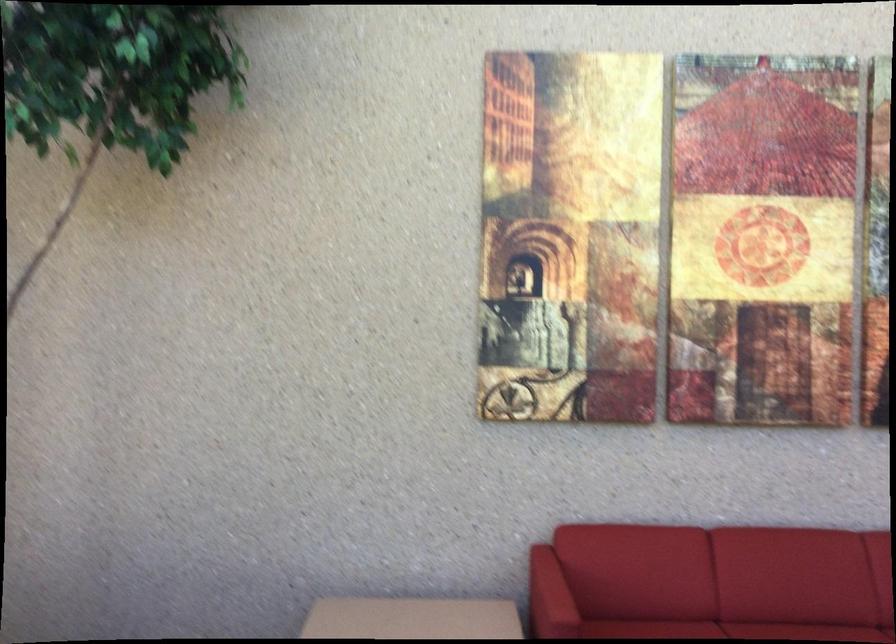
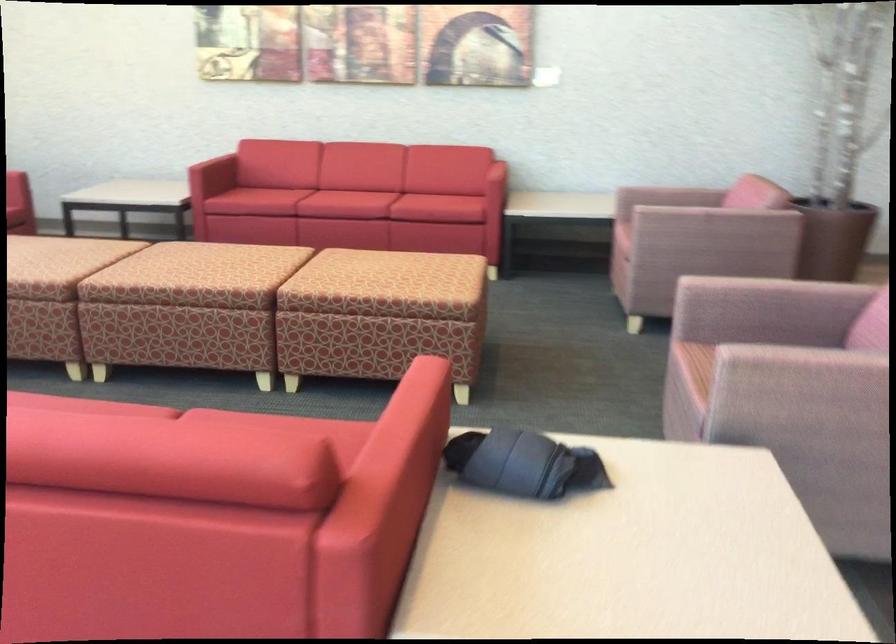
Question: I am providing you with two images of the same scene from different viewpoints. After the viewpoint changes to image2, which objects are now occluded?

Choices:
 (A) rolled up clothing
 (B) metal milk pitcher
 (C) pink chair sitting surface
 (D) sofa armrest

Answer: (D)